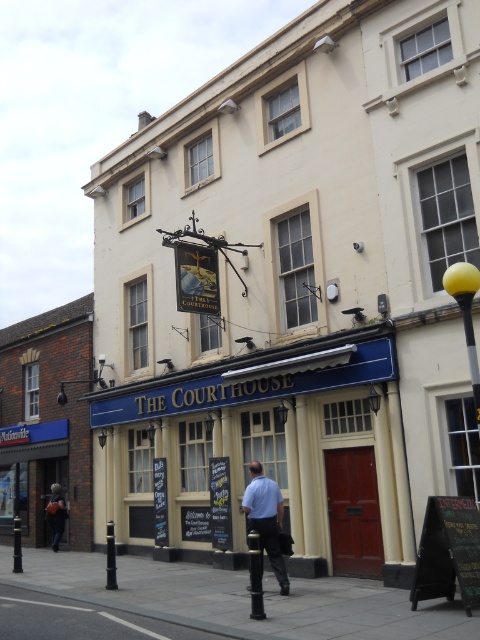
Looking at this image, does blue painted wooden pub at center lie behind blue shirt at center?

Yes, blue painted wooden pub at center is further from the viewer.

Based on the photo, between blue painted wooden pub at center and blue shirt at center, which one appears on the left side from the viewer's perspective?

blue painted wooden pub at center

What do you see at coordinates (268, 451) in the screenshot? This screenshot has width=480, height=640. I see `blue painted wooden pub at center` at bounding box center [268, 451].

Locate an element on the screen. Image resolution: width=480 pixels, height=640 pixels. blue painted wooden pub at center is located at coordinates (268, 451).

Is gray concrete pavement at lower center positioned before blue shirt at center?

Yes, gray concrete pavement at lower center is closer to the viewer.

Is gray concrete pavement at lower center above blue shirt at center?

No, gray concrete pavement at lower center is not above blue shirt at center.

Is point (237, 572) farther from camera compared to point (285, 579)?

Yes.

Locate an element on the screen. gray concrete pavement at lower center is located at coordinates (204, 604).

Who is shorter, blue painted wooden pub at center or gray concrete pavement at lower center?

gray concrete pavement at lower center

Can you confirm if blue painted wooden pub at center is positioned below gray concrete pavement at lower center?

No.

Is point (98, 497) farther from camera compared to point (298, 586)?

Yes, point (98, 497) is farther from viewer.

Find the location of a particular element. Image resolution: width=480 pixels, height=640 pixels. blue painted wooden pub at center is located at coordinates 268,451.